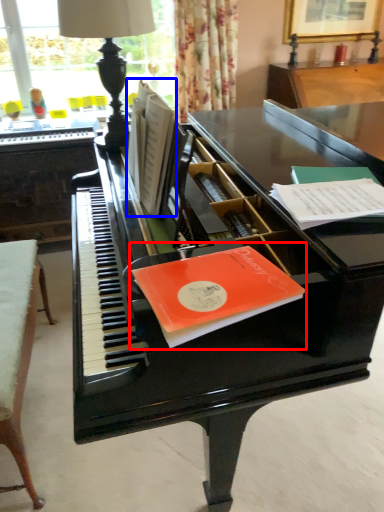
Question: Which of the following is the farthest to the observer, paperback book (highlighted by a red box) or book (highlighted by a blue box)?

Choices:
 (A) paperback book
 (B) book

Answer: (B)